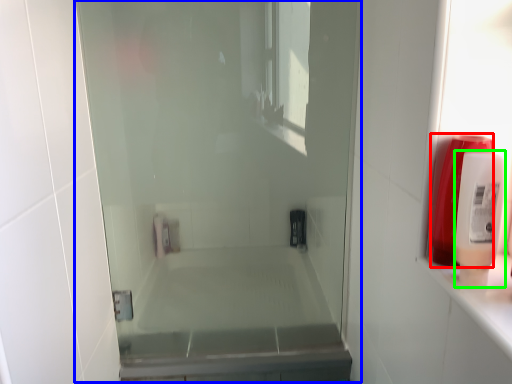
Question: Based on their relative distances, which object is nearer to soap dispenser (highlighted by a red box)? Choose from screen door (highlighted by a blue box) and soap dispenser (highlighted by a green box).

Choices:
 (A) screen door
 (B) soap dispenser

Answer: (B)